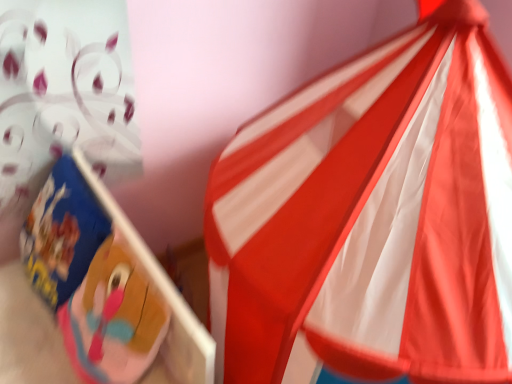
Question: Is the position of blue cardboard box at left less distant than that of red/white striped tent at upper right?

Choices:
 (A) yes
 (B) no

Answer: (B)

Question: Is blue cardboard box at left positioned behind red/white striped tent at upper right?

Choices:
 (A) no
 (B) yes

Answer: (B)

Question: Is blue cardboard box at left turned away from red/white striped tent at upper right?

Choices:
 (A) yes
 (B) no

Answer: (A)

Question: Can you confirm if blue cardboard box at left is positioned to the right of red/white striped tent at upper right?

Choices:
 (A) no
 (B) yes

Answer: (A)

Question: Is blue cardboard box at left not within red/white striped tent at upper right?

Choices:
 (A) yes
 (B) no

Answer: (A)

Question: Considering the relative sizes of blue cardboard box at left and red/white striped tent at upper right in the image provided, is blue cardboard box at left taller than red/white striped tent at upper right?

Choices:
 (A) no
 (B) yes

Answer: (A)

Question: From a real-world perspective, is red/white striped tent at upper right on blue cardboard box at left?

Choices:
 (A) yes
 (B) no

Answer: (A)

Question: Is blue cardboard box at left located within red/white striped tent at upper right?

Choices:
 (A) yes
 (B) no

Answer: (B)

Question: Is red/white striped tent at upper right smaller than blue cardboard box at left?

Choices:
 (A) no
 (B) yes

Answer: (A)

Question: Is red/white striped tent at upper right not close to blue cardboard box at left?

Choices:
 (A) yes
 (B) no

Answer: (B)

Question: Is red/white striped tent at upper right bigger than blue cardboard box at left?

Choices:
 (A) yes
 (B) no

Answer: (A)

Question: From a real-world perspective, is red/white striped tent at upper right located beneath blue cardboard box at left?

Choices:
 (A) no
 (B) yes

Answer: (A)

Question: In terms of width, does blue cardboard box at left look wider or thinner when compared to red/white striped tent at upper right?

Choices:
 (A) wide
 (B) thin

Answer: (B)